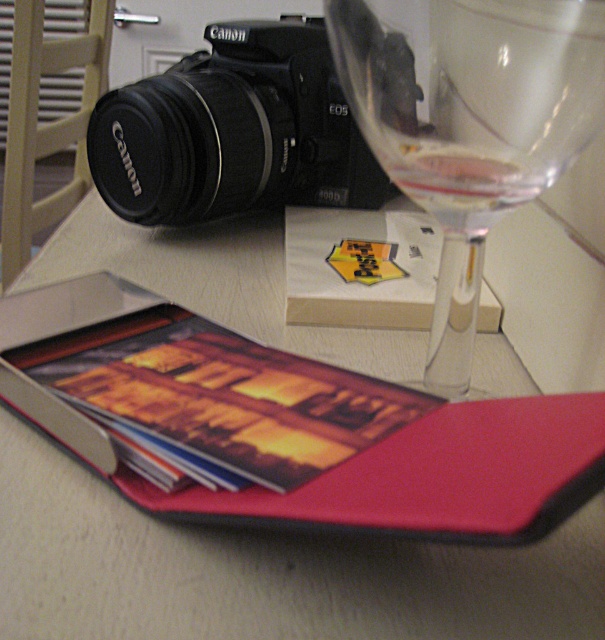
Consider the image. You have a small toy car that is 10 centimeters long. You want to place it on either the matte plastic tray at upper left or the clear glass wine at upper right. Based on their sizes, which surface can definitely fit the toy car?

The matte plastic tray at upper left might be wider than clear glass wine at upper right, so it is possible that the matte plastic tray at upper left can fit the toy car, but the clear glass wine at upper right might be too narrow.

You are organizing items on a desk and need to place a new item between the matte plastic tray at upper left and the black matte canon camera at upper left. Is there enough space between them for the new item?

The matte plastic tray at upper left is closer to the viewer than the black matte canon camera at upper left, so there is space between them for the new item.

You are a photographer holding a camera that is 6 inches long. You want to place it on the matte plastic tray at upper left. Can you fit it there?

The matte plastic tray at upper left is 6.78 inches from viewer. Since the camera is 6 inches long, it should fit on the tray as the tray is slightly longer than the camera.